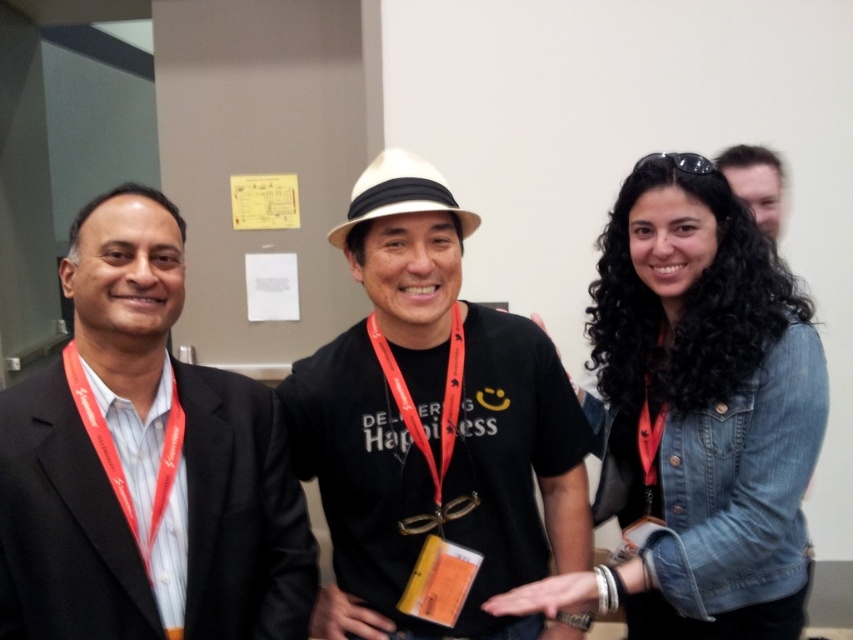
Question: Can you confirm if matte black t-shirt at center is wider than orange fabric lanyard at center?

Choices:
 (A) yes
 (B) no

Answer: (A)

Question: Can you confirm if denim jacket at right is positioned to the left of smooth skin face at upper right?

Choices:
 (A) no
 (B) yes

Answer: (B)

Question: Is black suit at left above orange fabric lanyard at center?

Choices:
 (A) no
 (B) yes

Answer: (A)

Question: Which point is closer to the camera?

Choices:
 (A) pyautogui.click(x=71, y=314)
 (B) pyautogui.click(x=781, y=218)

Answer: (B)

Question: Considering the real-world distances, which object is closest to the orange fabric lanyard at center?

Choices:
 (A) gold metallic medal at center
 (B) matte black t-shirt at center
 (C) black suit at left
 (D) matte black necktie at left

Answer: (B)

Question: Which point is farther to the camera?

Choices:
 (A) (762, 172)
 (B) (608, 248)
 (C) (453, 499)
 (D) (25, 545)

Answer: (A)